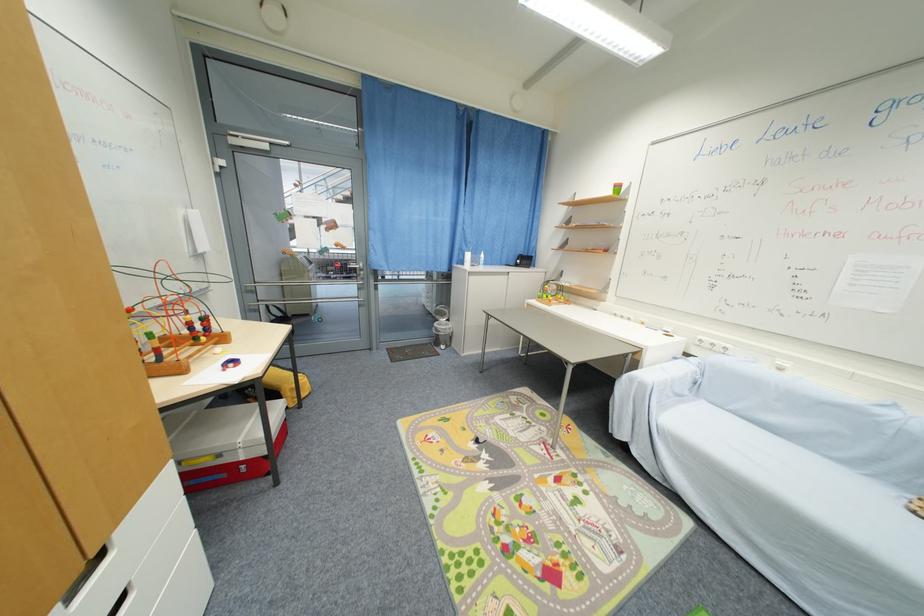
This screenshot has height=616, width=924. What are the coordinates of `sofa sitting surface` in the screenshot? It's located at (793, 467).